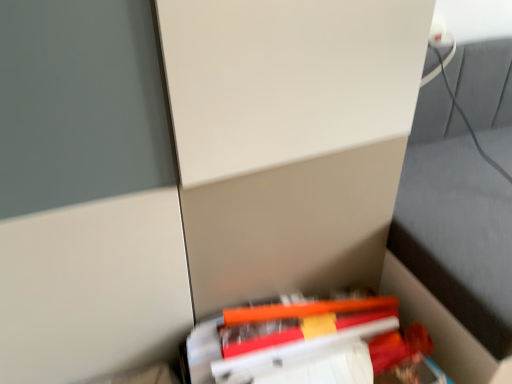
Question: Considering the relative sizes of orange matte book at lower center and orange matte pencil at lower center in the image provided, is orange matte book at lower center bigger than orange matte pencil at lower center?

Choices:
 (A) no
 (B) yes

Answer: (B)

Question: Is there a large distance between orange matte book at lower center and orange matte pencil at lower center?

Choices:
 (A) no
 (B) yes

Answer: (A)

Question: Is orange matte book at lower center aimed at orange matte pencil at lower center?

Choices:
 (A) no
 (B) yes

Answer: (A)

Question: Considering the relative positions of orange matte book at lower center and orange matte pencil at lower center in the image provided, is orange matte book at lower center in front of orange matte pencil at lower center?

Choices:
 (A) yes
 (B) no

Answer: (A)

Question: Does orange matte book at lower center have a greater width compared to orange matte pencil at lower center?

Choices:
 (A) yes
 (B) no

Answer: (A)

Question: Can we say orange matte book at lower center lies outside orange matte pencil at lower center?

Choices:
 (A) no
 (B) yes

Answer: (B)

Question: Considering the relative positions of orange matte pencil at lower center and orange matte book at lower center in the image provided, is orange matte pencil at lower center to the right of orange matte book at lower center from the viewer's perspective?

Choices:
 (A) yes
 (B) no

Answer: (A)

Question: From a real-world perspective, is orange matte pencil at lower center physically below orange matte book at lower center?

Choices:
 (A) yes
 (B) no

Answer: (B)

Question: Is orange matte pencil at lower center next to orange matte book at lower center and touching it?

Choices:
 (A) yes
 (B) no

Answer: (A)

Question: Is orange matte pencil at lower center closer to the viewer compared to orange matte book at lower center?

Choices:
 (A) no
 (B) yes

Answer: (A)

Question: Would you consider orange matte pencil at lower center to be distant from orange matte book at lower center?

Choices:
 (A) yes
 (B) no

Answer: (B)

Question: Is orange matte book at lower center at the back of orange matte pencil at lower center?

Choices:
 (A) yes
 (B) no

Answer: (B)

Question: Considering the positions of orange matte book at lower center and orange matte pencil at lower center in the image, is orange matte book at lower center taller or shorter than orange matte pencil at lower center?

Choices:
 (A) tall
 (B) short

Answer: (A)